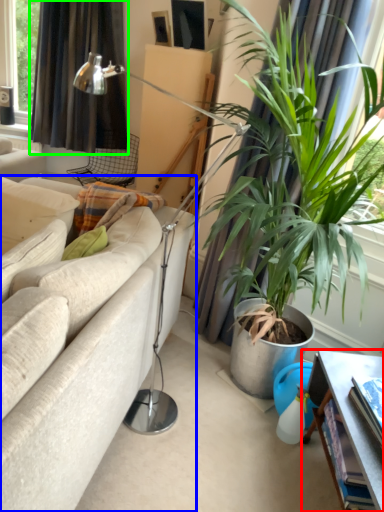
Question: Which object is positioned closest to table (highlighted by a red box)? Select from studio couch (highlighted by a blue box) and curtain (highlighted by a green box).

Choices:
 (A) studio couch
 (B) curtain

Answer: (A)